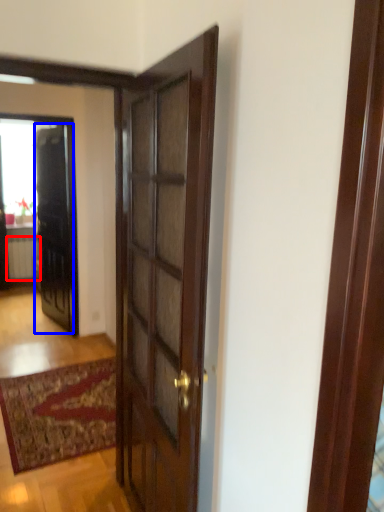
Question: Which point is further to the camera, radiator (highlighted by a red box) or door (highlighted by a blue box)?

Choices:
 (A) radiator
 (B) door

Answer: (A)